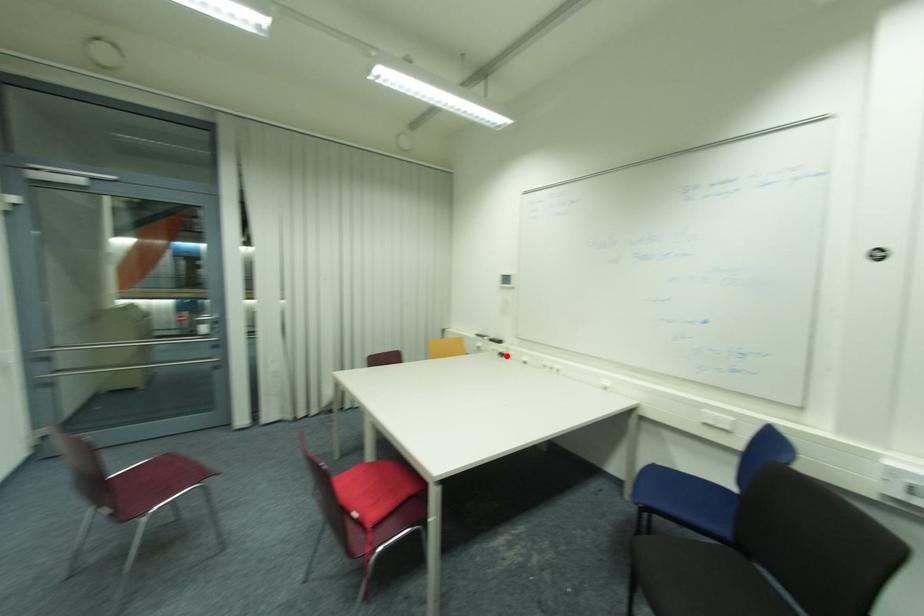
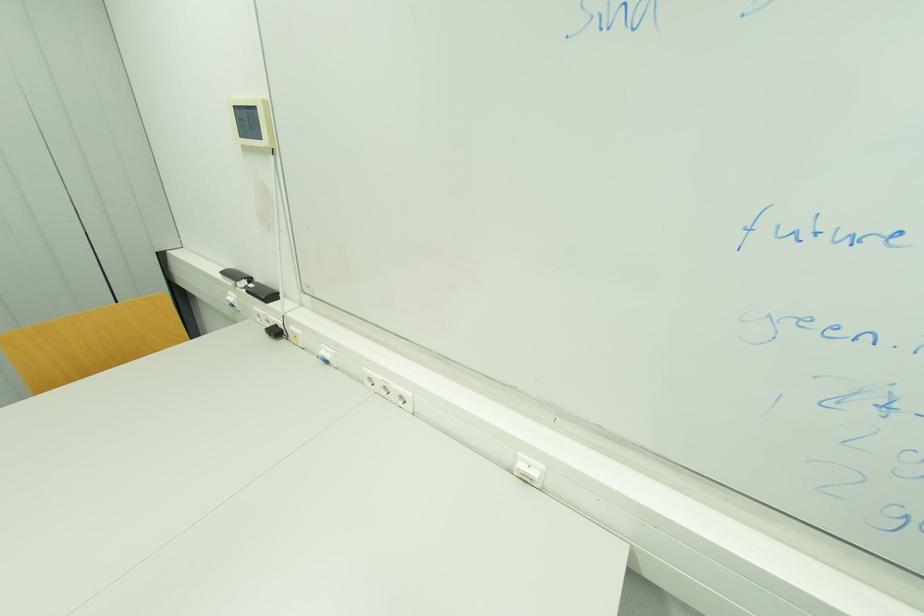
The point at the highlighted location is marked in the first image. Where is the corresponding point in the second image?

(281, 333)